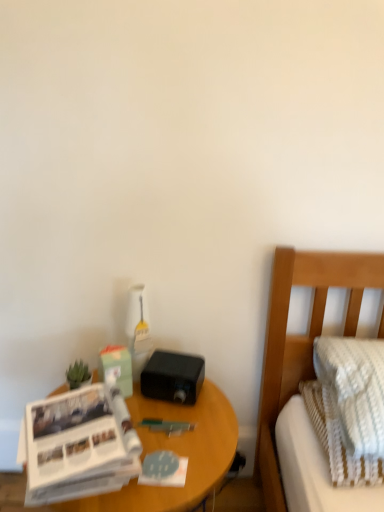
Question: Does wooden nightstand at lower left have a lesser width compared to white paper at left?

Choices:
 (A) yes
 (B) no

Answer: (B)

Question: Does wooden nightstand at lower left come behind white paper at left?

Choices:
 (A) no
 (B) yes

Answer: (B)

Question: Considering the relative positions of wooden nightstand at lower left and white paper at left in the image provided, is wooden nightstand at lower left to the left of white paper at left from the viewer's perspective?

Choices:
 (A) yes
 (B) no

Answer: (B)

Question: Can you confirm if wooden nightstand at lower left is positioned to the right of white paper at left?

Choices:
 (A) no
 (B) yes

Answer: (B)

Question: From the image's perspective, does wooden nightstand at lower left appear lower than white paper at left?

Choices:
 (A) no
 (B) yes

Answer: (B)

Question: Is wooden nightstand at lower left not within white paper at left?

Choices:
 (A) yes
 (B) no

Answer: (A)

Question: Can you see wooden nightstand at lower left touching textured beige pillow at right?

Choices:
 (A) yes
 (B) no

Answer: (B)

Question: Is wooden nightstand at lower left facing towards textured beige pillow at right?

Choices:
 (A) yes
 (B) no

Answer: (B)

Question: Can you confirm if wooden nightstand at lower left is positioned to the right of textured beige pillow at right?

Choices:
 (A) yes
 (B) no

Answer: (B)

Question: Is wooden nightstand at lower left positioned with its back to textured beige pillow at right?

Choices:
 (A) no
 (B) yes

Answer: (A)

Question: Is wooden nightstand at lower left to the left of textured beige pillow at right from the viewer's perspective?

Choices:
 (A) no
 (B) yes

Answer: (B)

Question: Does wooden nightstand at lower left have a greater height compared to textured beige pillow at right?

Choices:
 (A) no
 (B) yes

Answer: (B)

Question: From the image's perspective, is green matte plant at left over wooden nightstand at lower left?

Choices:
 (A) yes
 (B) no

Answer: (A)